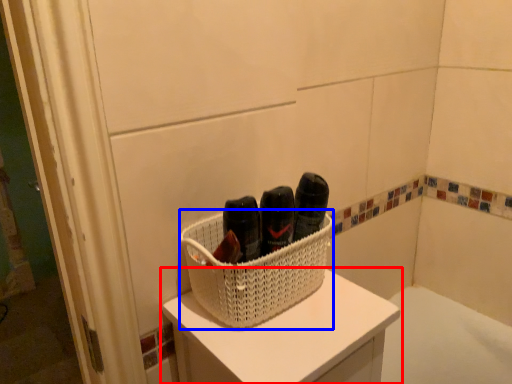
Question: Which of the following is the closest to the observer, furniture (highlighted by a red box) or basket (highlighted by a blue box)?

Choices:
 (A) furniture
 (B) basket

Answer: (A)